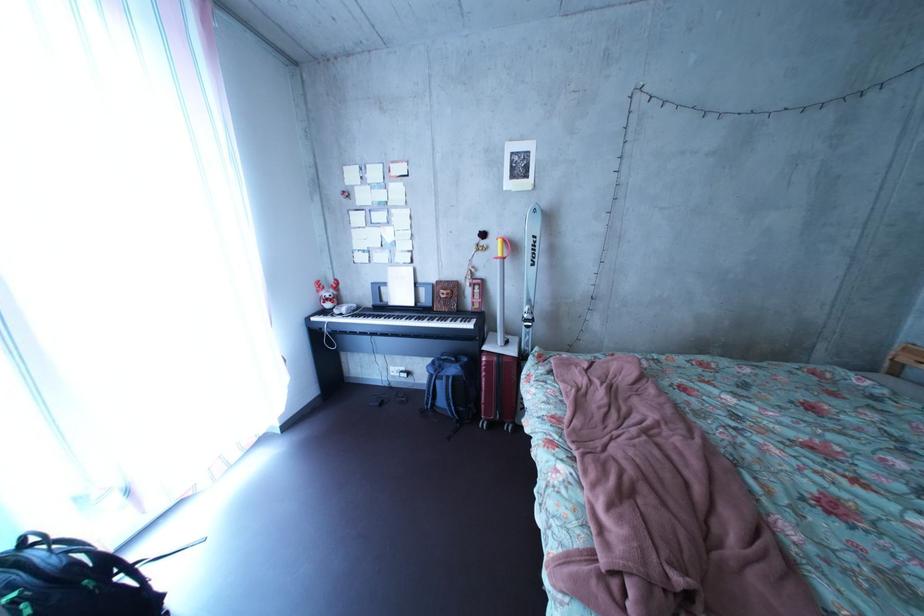
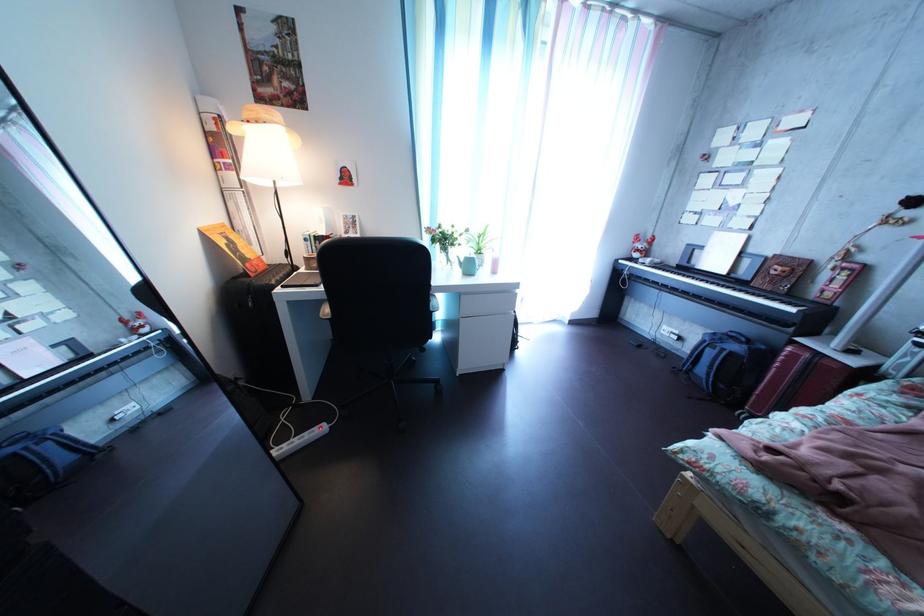
From the picture: The first image is from the beginning of the video and the second image is from the end. How did the camera likely rotate when shooting the video?

The camera's rotation is toward left-down.